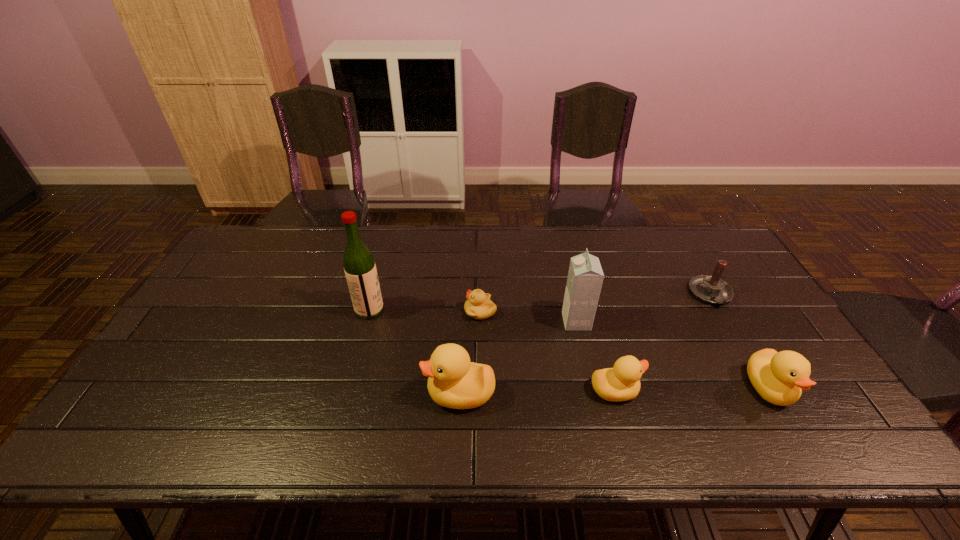
This screenshot has height=540, width=960. Identify the location of the second duckling from right to left. (622, 382).

Identify the location of the second tallest duckling. The image size is (960, 540). (779, 377).

Where is `the tallest object`? This screenshot has width=960, height=540. the tallest object is located at coordinates (360, 270).

The image size is (960, 540). What are the coordinates of `liquor` in the screenshot? It's located at (360, 270).

You are a GUI agent. You are given a task and a screenshot of the screen. Output one action in this format:
    pyautogui.click(x=<x>, y=<y>)
    Task: Click on the candle
    This screenshot has width=960, height=540.
    Given the screenshot: What is the action you would take?
    [x=711, y=289]

Locate an element on the screen. The width and height of the screenshot is (960, 540). the second tallest object is located at coordinates (585, 277).

Image resolution: width=960 pixels, height=540 pixels. What are the coordinates of `the shortest object` in the screenshot? It's located at (478, 306).

The height and width of the screenshot is (540, 960). I want to click on the shortest duckling, so click(478, 306).

The image size is (960, 540). Find the location of `free location located 0.180m on the face of the second shortest duckling`. free location located 0.180m on the face of the second shortest duckling is located at coordinates (712, 390).

Image resolution: width=960 pixels, height=540 pixels. In order to click on blank space located 0.290m on the label of the liquor in this screenshot , I will do `click(481, 310)`.